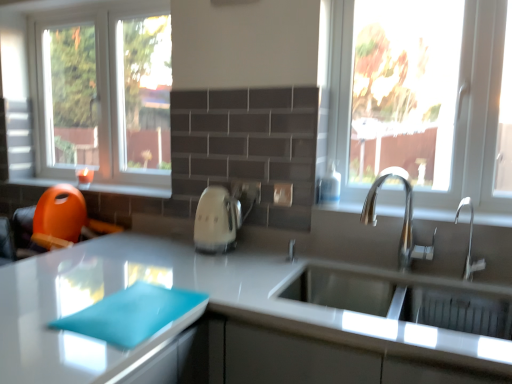
Question: Is point (409, 220) closer or farther from the camera than point (268, 365)?

Choices:
 (A) farther
 (B) closer

Answer: (A)

Question: From the image's perspective, is silver metallic faucet at center, the second tap when ordered from right to left, positioned above or below white glossy cutting board at lower left?

Choices:
 (A) above
 (B) below

Answer: (A)

Question: Which object is the closest to the satin nickel faucet at sink right, positioned as the first tap in right-to-left order?

Choices:
 (A) transparent glass window at upper right, which is the 2th window in back-to-front order
 (B) silver metallic faucet at center, the second tap when ordered from right to left
 (C) teal fabric placemat at center
 (D) metallic silver sink at right, arranged as the 2th window sill when viewed from the back
 (E) white glossy cutting board at lower left

Answer: (D)

Question: Estimate the real-world distances between objects in this image. Which object is closer to the satin nickel faucet at sink right, positioned as the first tap in right-to-left order?

Choices:
 (A) transparent glass window at upper right, arranged as the 2th window when viewed from the left
 (B) white glossy electric kettle at center
 (C) clear glass window at left, arranged as the second window when viewed from the right
 (D) white glossy cutting board at lower left
 (E) metallic silver sink at right, marked as the 1th window sill in a bottom-to-top arrangement

Answer: (E)